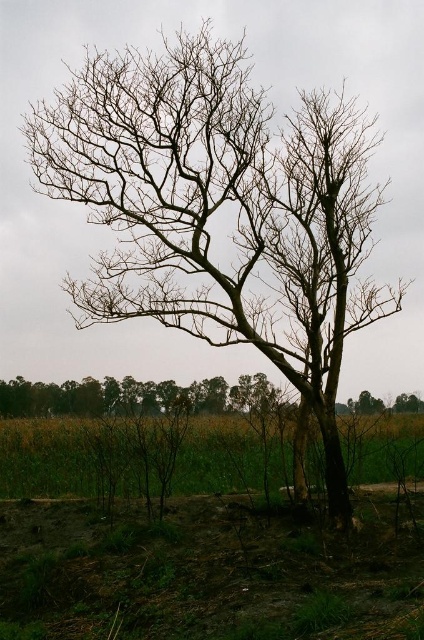
You are a gardener assessing the health of the landscape. You observe the green grass at lower center and the brown leafless tree at center. Which area of the landscape has more coverage?

The brown leafless tree at center has more coverage than the green grass at lower center, as the green grass at lower center occupies less space than the brown leafless tree at center.

You are a gardener who needs to determine which object is shorter between the green grass at lower center and the brown leafless tree at center. Which one is shorter?

The green grass at lower center is shorter than the brown leafless tree at center.

You are a gardener assessing the health of the landscape. You notice the green grass at lower center and the brown leafless tree at center. Which of these two has a smaller width?

The green grass at lower center is thinner than the brown leafless tree at center, so the green grass at lower center has a smaller width.